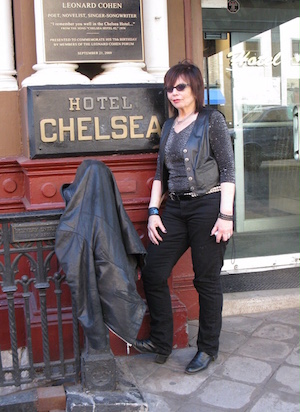
The width and height of the screenshot is (300, 412). What are the coordinates of `wrought iron railing` in the screenshot? It's located at point(13,339), point(30,346), point(46,346), point(62,346), point(76,349), point(98,359), point(22,250).